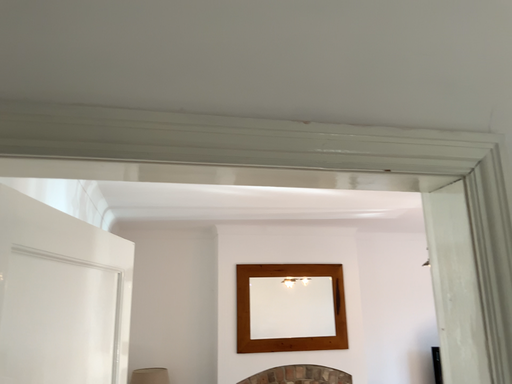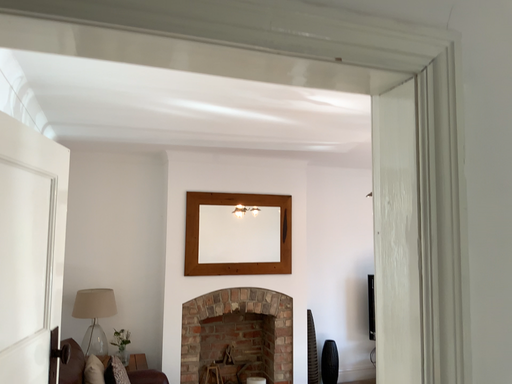
Question: How did the camera likely rotate when shooting the video?

Choices:
 (A) rotated downward
 (B) rotated upward

Answer: (A)